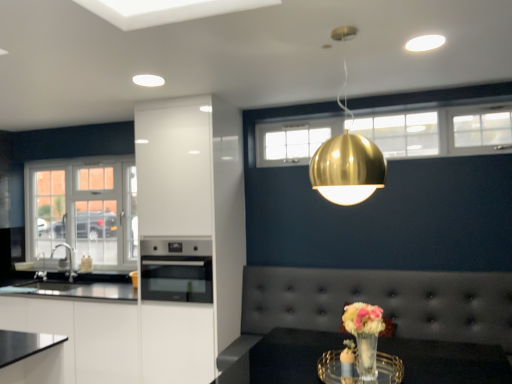
Question: Is stainless steel oven at center next to white glass window at left?

Choices:
 (A) yes
 (B) no

Answer: (B)

Question: Does stainless steel oven at center contain white glass window at left?

Choices:
 (A) yes
 (B) no

Answer: (B)

Question: Is stainless steel oven at center positioned beyond the bounds of white glass window at left?

Choices:
 (A) no
 (B) yes

Answer: (B)

Question: Considering the relative positions of stainless steel oven at center and white glass window at left in the image provided, is stainless steel oven at center in front of white glass window at left?

Choices:
 (A) no
 (B) yes

Answer: (B)

Question: Is white glass window at left at the back of stainless steel oven at center?

Choices:
 (A) yes
 (B) no

Answer: (B)

Question: Would you say gold metallic sphere at upper center is to the left or to the right of white glossy cabinet at center in the picture?

Choices:
 (A) left
 (B) right

Answer: (B)

Question: Is gold metallic sphere at upper center spatially inside white glossy cabinet at center, or outside of it?

Choices:
 (A) outside
 (B) inside

Answer: (A)

Question: Considering the positions of gold metallic sphere at upper center and white glossy cabinet at center in the image, is gold metallic sphere at upper center wider or thinner than white glossy cabinet at center?

Choices:
 (A) thin
 (B) wide

Answer: (A)

Question: From the image's perspective, relative to white glossy cabinet at center, is gold metallic sphere at upper center above or below?

Choices:
 (A) above
 (B) below

Answer: (A)

Question: From the image's perspective, relative to white glossy cabinet at lower left, is gold metallic sphere at upper center above or below?

Choices:
 (A) below
 (B) above

Answer: (B)

Question: In the image, is gold metallic sphere at upper center positioned in front of or behind white glossy cabinet at lower left?

Choices:
 (A) behind
 (B) front

Answer: (B)

Question: Considering the positions of gold metallic sphere at upper center and white glossy cabinet at lower left in the image, is gold metallic sphere at upper center taller or shorter than white glossy cabinet at lower left?

Choices:
 (A) short
 (B) tall

Answer: (A)

Question: Considering the positions of gold metallic sphere at upper center and white glossy cabinet at lower left in the image, is gold metallic sphere at upper center wider or thinner than white glossy cabinet at lower left?

Choices:
 (A) wide
 (B) thin

Answer: (B)

Question: Is tufted leather couch at center bigger or smaller than gold metallic sphere at upper center?

Choices:
 (A) small
 (B) big

Answer: (B)

Question: Does point (500, 327) appear closer or farther from the camera than point (342, 107)?

Choices:
 (A) closer
 (B) farther

Answer: (A)